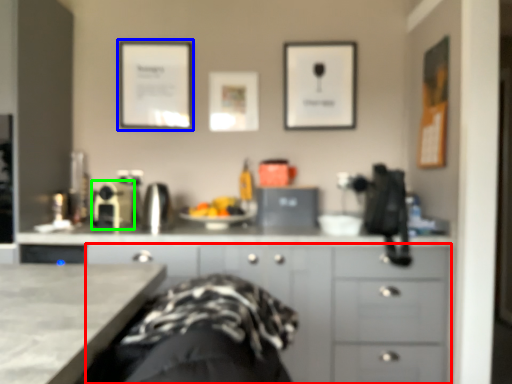
Question: Considering the real-world distances, which object is farthest from cabinetry (highlighted by a red box)? picture frame (highlighted by a blue box) or appliance (highlighted by a green box)?

Choices:
 (A) picture frame
 (B) appliance

Answer: (A)